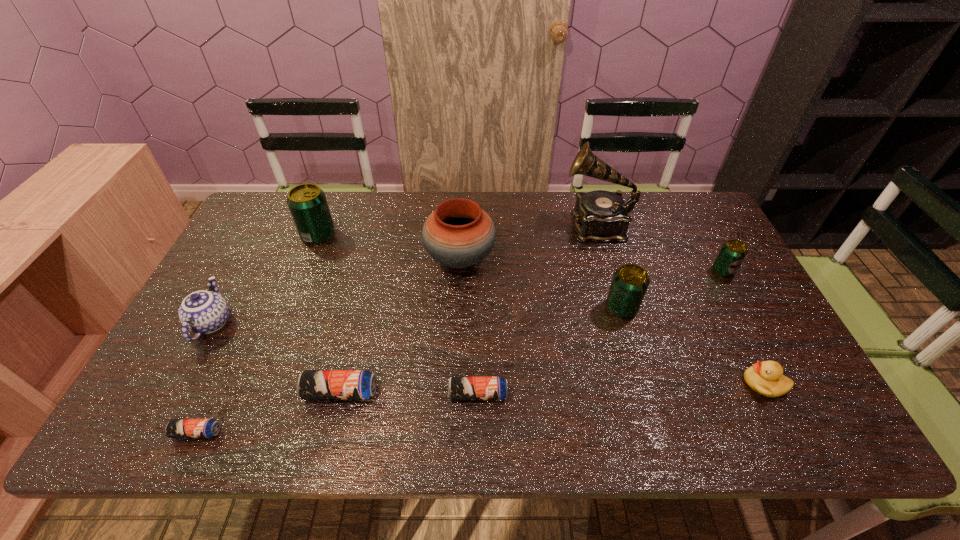
Identify the location of phonograph record. (601, 216).

You are a GUI agent. You are given a task and a screenshot of the screen. Output one action in this format:
    pyautogui.click(x=<x>, y=<y>)
    Task: Click on the pottery
    The width and height of the screenshot is (960, 540).
    Given the screenshot: What is the action you would take?
    pyautogui.click(x=458, y=234)

I want to click on the farthest green beer can, so click(x=307, y=203).

I want to click on the biggest green beer can, so [x=307, y=203].

Image resolution: width=960 pixels, height=540 pixels. Find the location of `the fourth nearest beer can`. the fourth nearest beer can is located at coordinates (630, 282).

The image size is (960, 540). I want to click on the second smallest green beer can, so click(x=630, y=282).

You are a GUI agent. You are given a task and a screenshot of the screen. Output one action in this format:
    pyautogui.click(x=<x>, y=<y>)
    Task: Click on the blue chinaware
    
    Given the screenshot: What is the action you would take?
    pyautogui.click(x=203, y=312)

Where is `the rightmost green beer can`? The image size is (960, 540). the rightmost green beer can is located at coordinates (732, 253).

The height and width of the screenshot is (540, 960). In order to click on the second farthest beer can in this screenshot , I will do `click(732, 253)`.

Locate an element on the screen. The height and width of the screenshot is (540, 960). duckling is located at coordinates (766, 378).